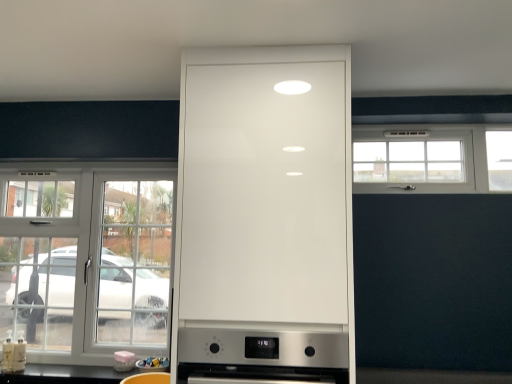
Locate an element on the screen. free spot above black glossy countertop at lower left (from a real-world perspective) is located at coordinates (74, 366).